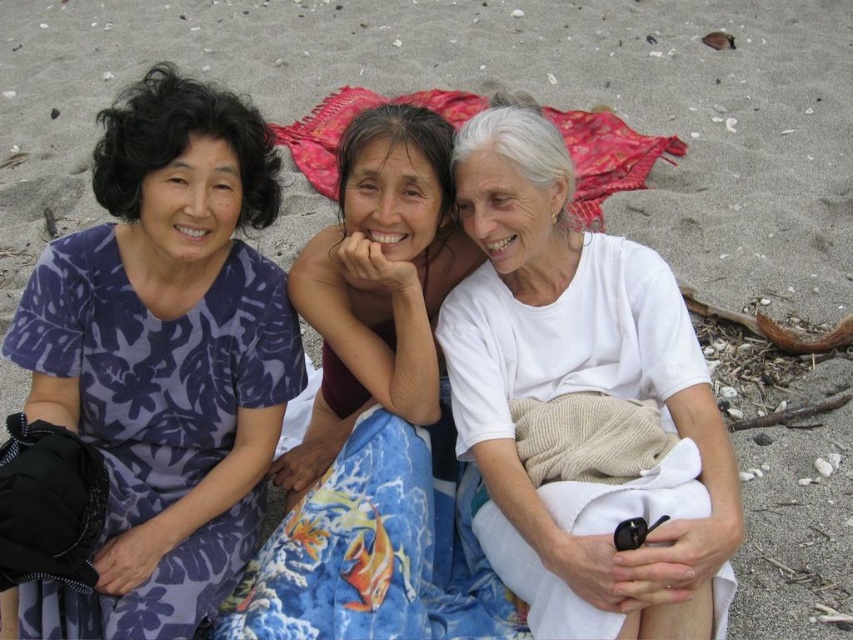
You are a photographer standing in front of the three women on the beach. You want to take a photo that includes both the purple floral dress at left and the white cotton shirt at center. Which object should be closer to the camera to ensure both are in focus?

The white cotton shirt at center is behind the purple floral dress at left, so to ensure both are in focus, the purple floral dress at left should be closer to the camera.

You are a photographer taking a group photo of the purple floral dress at left and the white cotton shirt at center. To ensure both subjects are in frame, should you position the camera to the left or to the right of the two women?

The purple floral dress at left is to the left of the white cotton shirt at center, so positioning the camera to the right of the two women would ensure both subjects are in frame.